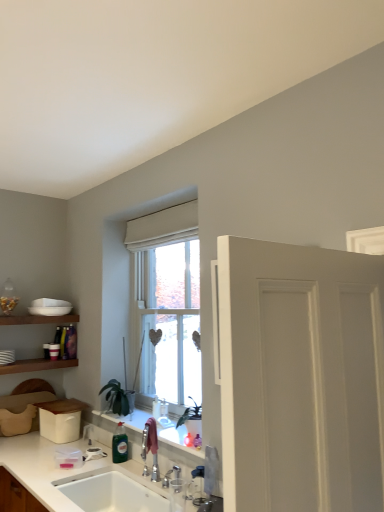
I want to click on free space in front of green glass bottle at sink, so click(x=115, y=475).